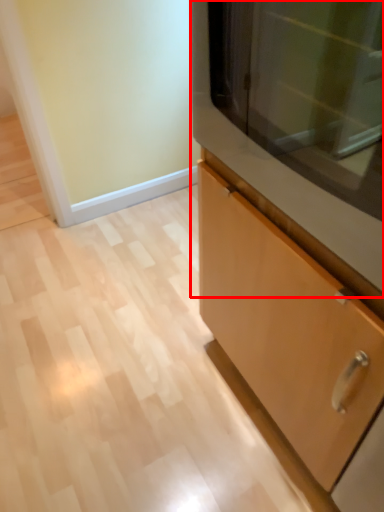
Question: Where is microwave (annotated by the red box) located in relation to cabinetry in the image?

Choices:
 (A) left
 (B) right

Answer: (A)